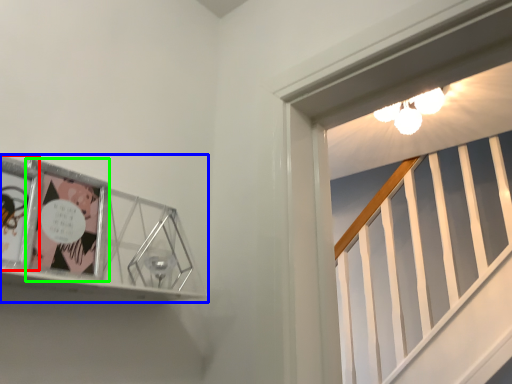
Question: Estimate the real-world distances between objects in this image. Which object is farther from comic book (highlighted by a red box), picture frame (highlighted by a blue box) or comic book (highlighted by a green box)?

Choices:
 (A) picture frame
 (B) comic book

Answer: (A)